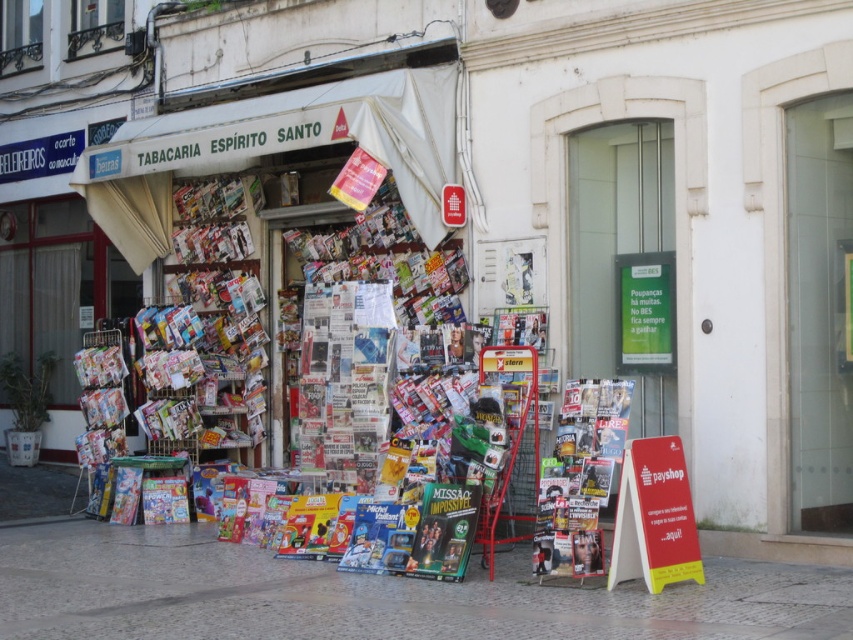
You are a delivery person trying to place a new shiny metallic magazine at center on the smooth stone pavement at lower center. Will the magazine fit entirely on the pavement without overhanging?

The smooth stone pavement at lower center is wider than the shiny metallic magazine at center, so the magazine will fit entirely without overhanging.

You are standing in front of the Tabacaria Espirito Santo shop and want to take a photo of the entrance. You notice two points marked in the scene. The first point is at coordinate point (x=248, y=636) and the second is at coordinate point (x=593, y=410). Which point will appear larger in your photo?

Point (x=248, y=636) is closer to the camera than point (x=593, y=410), so it will appear larger in the photo.